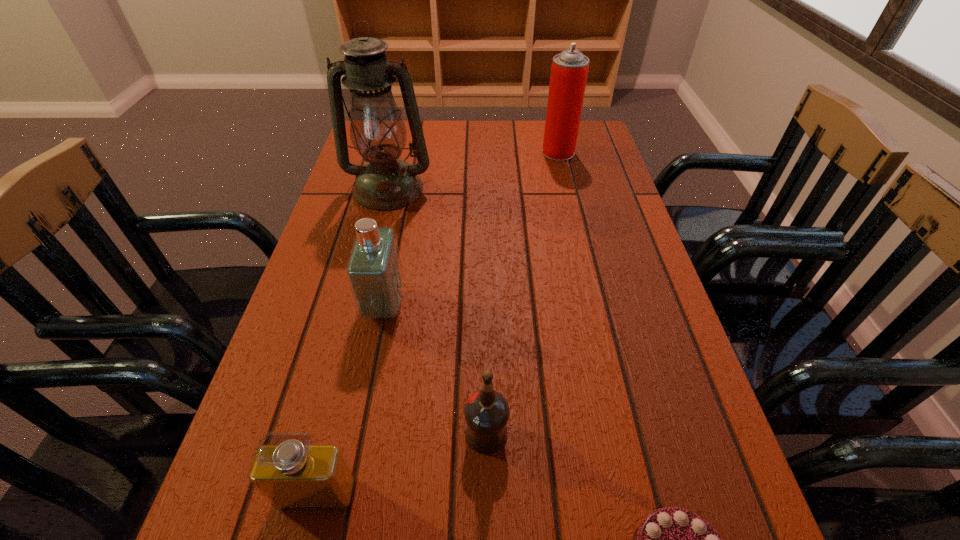
At what (x,y) coordinates should I click in order to perform the action: click on oil lamp. Please return your answer as a coordinate pair (x, y). Looking at the image, I should click on (378, 133).

Identify the location of the second farthest object. (378, 133).

Where is `the fifth shortest object`? The height and width of the screenshot is (540, 960). the fifth shortest object is located at coordinates (569, 70).

Where is `the farthest object`? The width and height of the screenshot is (960, 540). the farthest object is located at coordinates (569, 70).

Find the location of a particular element. The image size is (960, 540). the fourth shortest object is located at coordinates (374, 272).

You are a GUI agent. You are given a task and a screenshot of the screen. Output one action in this format:
    pyautogui.click(x=<x>, y=<y>)
    Task: Click on the taller perfume
    This screenshot has width=960, height=540.
    Given the screenshot: What is the action you would take?
    pyautogui.click(x=374, y=272)

Where is `vodka`? The height and width of the screenshot is (540, 960). vodka is located at coordinates pos(486,411).

Locate an element on the screen. the third object from right to left is located at coordinates (486, 411).

At what (x,y) coordinates should I click in order to perform the action: click on the shorter perfume. Please return your answer as a coordinate pair (x, y). This screenshot has width=960, height=540. Looking at the image, I should click on (292, 473).

The width and height of the screenshot is (960, 540). I want to click on the nearer perfume, so click(292, 473).